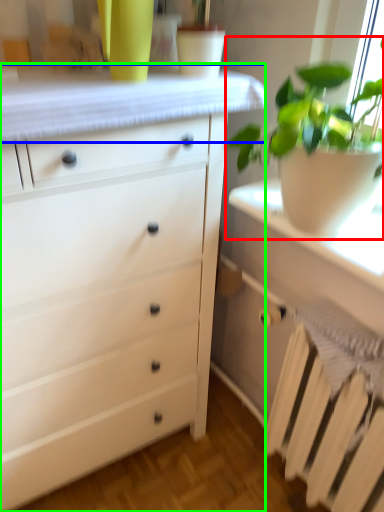
Question: Which object is positioned closest to houseplant (highlighted by a red box)? Select from counter top (highlighted by a blue box) and chest of drawers (highlighted by a green box).

Choices:
 (A) counter top
 (B) chest of drawers

Answer: (A)